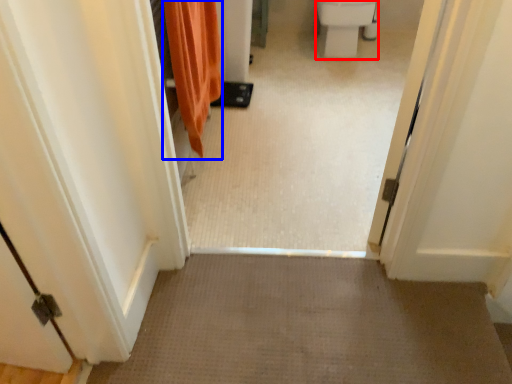
Question: Which of the following is the farthest to the observer, toilet bowl (highlighted by a red box) or shower curtain (highlighted by a blue box)?

Choices:
 (A) toilet bowl
 (B) shower curtain

Answer: (A)